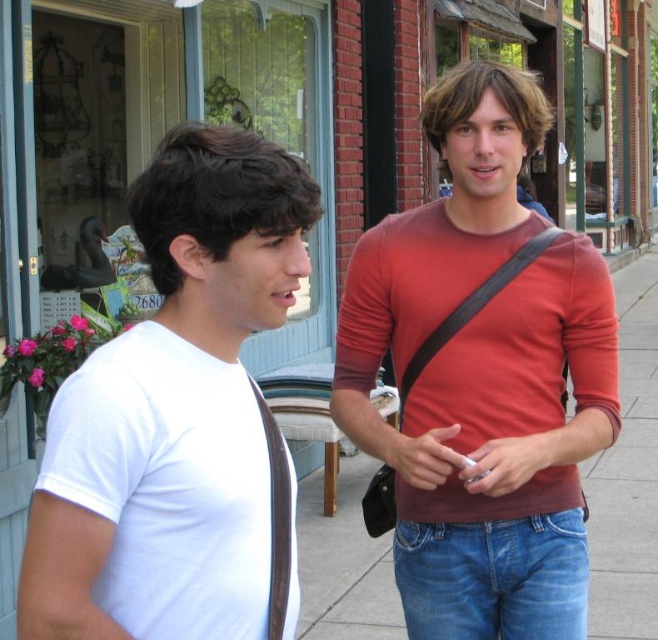
Question: Does white matte t-shirt at left have a greater width compared to blue denim jeans at lower right?

Choices:
 (A) no
 (B) yes

Answer: (A)

Question: Where is matte red shirt at center located in relation to blue denim jeans at lower right in the image?

Choices:
 (A) right
 (B) left

Answer: (B)

Question: Which object is farther from the camera taking this photo?

Choices:
 (A) white matte t-shirt at left
 (B) blue denim jeans at lower right

Answer: (B)

Question: Which object is the farthest from the white matte t-shirt at left?

Choices:
 (A) blue denim jeans at lower right
 (B) matte red shirt at center

Answer: (A)

Question: Estimate the real-world distances between objects in this image. Which object is closer to the matte red shirt at center?

Choices:
 (A) blue denim jeans at lower right
 (B) white matte t-shirt at left

Answer: (A)

Question: Does matte red shirt at center have a smaller size compared to blue denim jeans at lower right?

Choices:
 (A) no
 (B) yes

Answer: (A)